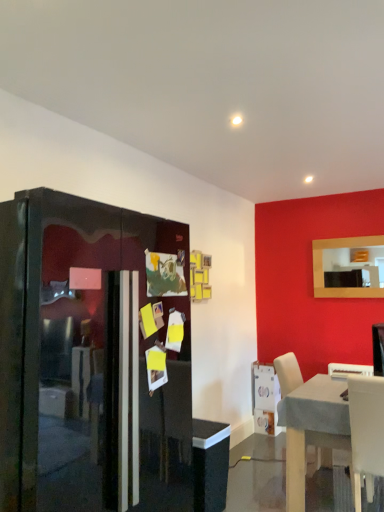
Question: Considering the relative sizes of light wood table at lower right and glossy black fridge at left in the image provided, is light wood table at lower right bigger than glossy black fridge at left?

Choices:
 (A) yes
 (B) no

Answer: (B)

Question: Considering the relative positions of light wood table at lower right and glossy black fridge at left in the image provided, is light wood table at lower right to the right of glossy black fridge at left from the viewer's perspective?

Choices:
 (A) yes
 (B) no

Answer: (A)

Question: From a real-world perspective, is light wood table at lower right positioned over glossy black fridge at left based on gravity?

Choices:
 (A) yes
 (B) no

Answer: (B)

Question: Would you say light wood table at lower right is outside glossy black fridge at left?

Choices:
 (A) yes
 (B) no

Answer: (A)

Question: Is light wood table at lower right turned away from glossy black fridge at left?

Choices:
 (A) yes
 (B) no

Answer: (B)

Question: In the image, is white glossy microwave at lower right positioned in front of or behind matte wooden mirror at upper right?

Choices:
 (A) front
 (B) behind

Answer: (B)

Question: Choose the correct answer: Is white glossy microwave at lower right inside matte wooden mirror at upper right or outside it?

Choices:
 (A) outside
 (B) inside

Answer: (A)

Question: Is white glossy microwave at lower right to the left or to the right of matte wooden mirror at upper right in the image?

Choices:
 (A) right
 (B) left

Answer: (B)

Question: Is white glossy microwave at lower right bigger or smaller than matte wooden mirror at upper right?

Choices:
 (A) big
 (B) small

Answer: (A)

Question: Based on their positions, is white glossy microwave at lower right located to the left or right of white plastic chair at lower right, marked as the 1th chair in a top-to-bottom arrangement?

Choices:
 (A) left
 (B) right

Answer: (A)

Question: In terms of width, does white glossy microwave at lower right look wider or thinner when compared to white plastic chair at lower right, which appears as the second chair when ordered from the bottom?

Choices:
 (A) wide
 (B) thin

Answer: (A)

Question: Is white glossy microwave at lower right situated inside white plastic chair at lower right, which appears as the second chair when ordered from the bottom, or outside?

Choices:
 (A) outside
 (B) inside

Answer: (A)

Question: Looking at the image, does white glossy microwave at lower right seem bigger or smaller compared to white plastic chair at lower right, marked as the 1th chair in a top-to-bottom arrangement?

Choices:
 (A) small
 (B) big

Answer: (B)

Question: From their relative heights in the image, would you say white plastic chair at lower right, the second chair positioned from the top, is taller or shorter than light wood table at lower right?

Choices:
 (A) short
 (B) tall

Answer: (B)

Question: From a real-world perspective, is white plastic chair at lower right, which is the second chair in back-to-front order, physically located above or below light wood table at lower right?

Choices:
 (A) below
 (B) above

Answer: (B)